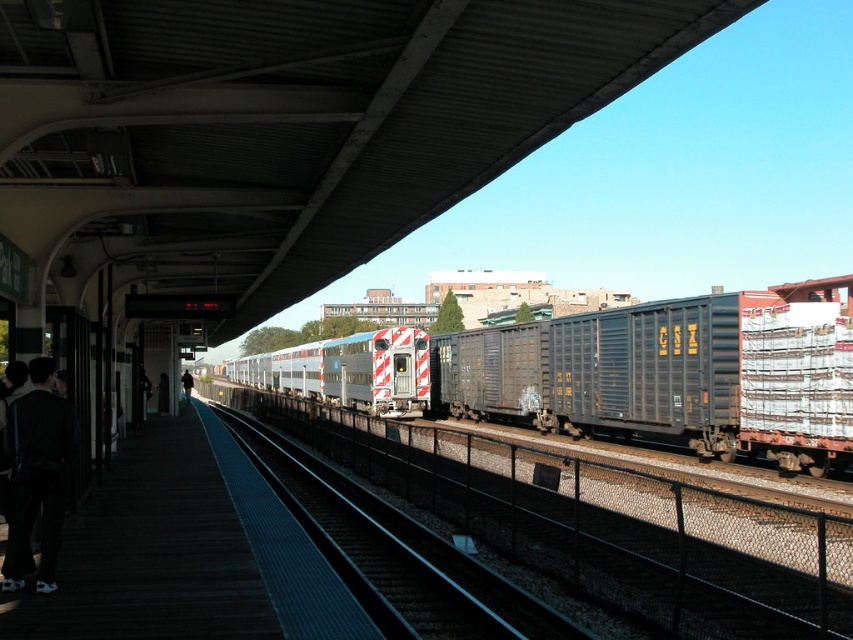
You are a maintenance worker at the train station. You need to place a safety barrier between the dark wood platform at lower left and the black metal train track at center. Considering the height difference, which object should the barrier be placed closer to?

The dark wood platform at lower left has a lesser height compared to black metal train track at center, so the safety barrier should be placed closer to the dark wood platform at lower left to ensure it is effective.

You are standing on the dark wood platform at lower left and see the black leather jacket at lower left. Is the jacket underneath the platform?

Yes, the dark wood platform at lower left is positioned over the black leather jacket at lower left, so the jacket is underneath the platform.

You are standing on the platform at the train station. You see a point marked at coordinate (671, 374). What object does this point correspond to?

The point at coordinate (671, 374) corresponds to the metallic gray freight car at center.